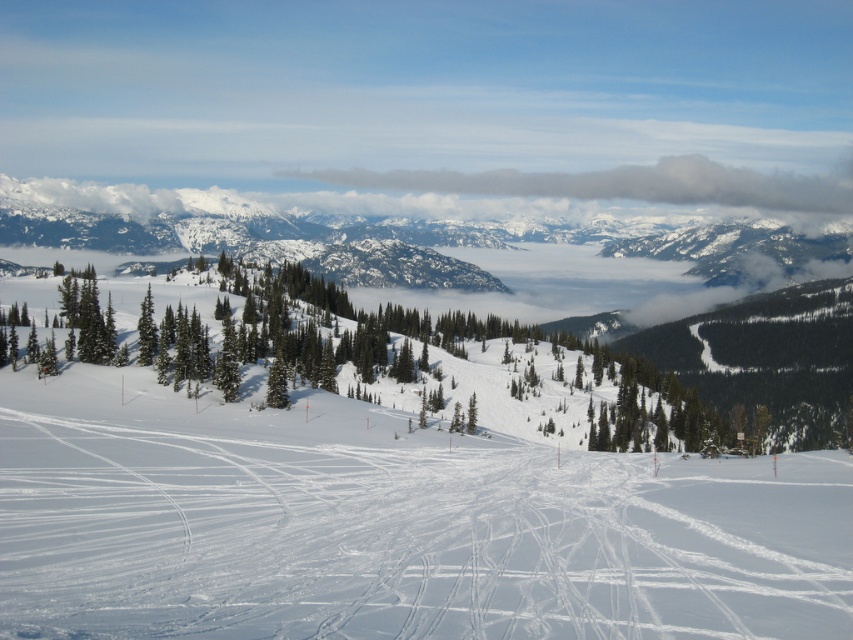
Question: Is white snow-covered mountain at upper center bigger than gray/cloudy cloud at upper center?

Choices:
 (A) yes
 (B) no

Answer: (A)

Question: Which point appears closest to the camera in this image?

Choices:
 (A) (579, 180)
 (B) (425, 291)

Answer: (B)

Question: Is white snow-covered mountain at upper center to the left of gray/cloudy cloud at upper center from the viewer's perspective?

Choices:
 (A) yes
 (B) no

Answer: (A)

Question: Which object is farther from the camera taking this photo?

Choices:
 (A) gray/cloudy cloud at upper center
 (B) white snow-covered mountain at upper center

Answer: (A)

Question: Which point is closer to the camera?

Choices:
 (A) white snow-covered mountain at upper center
 (B) gray/cloudy cloud at upper center

Answer: (A)

Question: Can you confirm if white snow-covered mountain at upper center is positioned below gray/cloudy cloud at upper center?

Choices:
 (A) no
 (B) yes

Answer: (B)